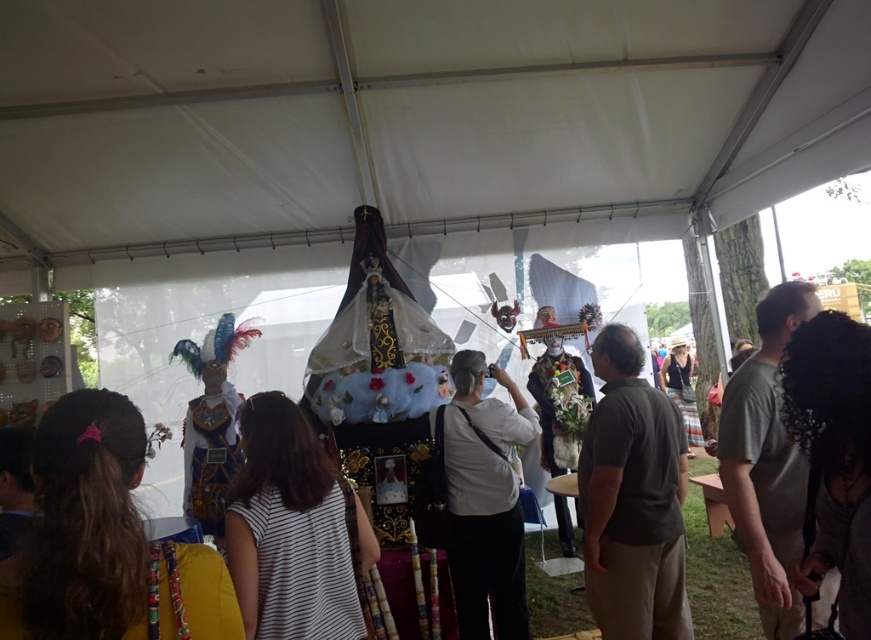
You are attending the event and want to take a photo of the white fabric mask at center without any obstructions. Is the white fabric canopy at upper center blocking your view of the mask?

The white fabric canopy at upper center is in front of the white fabric mask at center, so it is blocking the view of the mask. You will need to move to a position where the canopy is not in front of the mask to take an unobstructed photo.

You are attending the event and want to take a photo of the white fabric canopy at upper center and the white striped shirt at center. Which object should you focus on first to ensure both are in the frame?

You should focus on the white fabric canopy at upper center first because it is closer to you than the white striped shirt at center, so adjusting the camera to include it will also capture the shirt behind it.

You are organizing a photo shoot and need to arrange two shirts for a fashion display. The white striped shirt at center and the gray cotton shirt at right are available. Which shirt should you choose if you want the smaller one for a mannequin with limited space?

The white striped shirt at center has a smaller size compared to the gray cotton shirt at right, so it is the better choice for the mannequin with limited space.